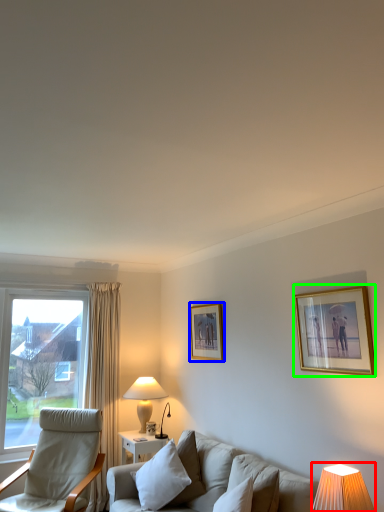
Question: Based on their relative distances, which object is nearer to table lamp (highlighted by a red box)? Choose from picture frame (highlighted by a blue box) and picture frame (highlighted by a green box).

Choices:
 (A) picture frame
 (B) picture frame

Answer: (B)